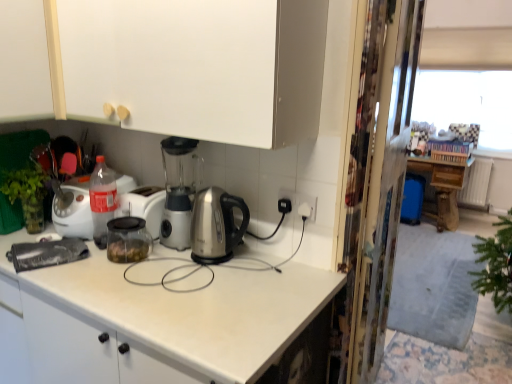
Question: Is wooden table at right further to camera compared to white matte cabinet at upper center, arranged as the first cabinetry when viewed from the right?

Choices:
 (A) yes
 (B) no

Answer: (A)

Question: Could you tell me if wooden table at right is turned towards white matte cabinet at upper center, arranged as the first cabinetry when viewed from the right?

Choices:
 (A) yes
 (B) no

Answer: (A)

Question: Is white matte cabinet at upper center, arranged as the first cabinetry when viewed from the right, a part of wooden table at right?

Choices:
 (A) yes
 (B) no

Answer: (B)

Question: Can you confirm if wooden table at right is shorter than white matte cabinet at upper center, arranged as the first cabinetry when viewed from the right?

Choices:
 (A) no
 (B) yes

Answer: (A)

Question: From the image's perspective, is wooden table at right over white matte cabinet at upper center, acting as the second cabinetry starting from the left?

Choices:
 (A) no
 (B) yes

Answer: (A)

Question: Is wooden table at right smaller than white matte cabinet at upper center, acting as the second cabinetry starting from the left?

Choices:
 (A) yes
 (B) no

Answer: (A)

Question: Considering the relative sizes of clear glass jar at center and white matte cabinet at upper center, acting as the second cabinetry starting from the left, in the image provided, is clear glass jar at center wider than white matte cabinet at upper center, acting as the second cabinetry starting from the left,?

Choices:
 (A) yes
 (B) no

Answer: (B)

Question: Does clear glass jar at center have a larger size compared to white matte cabinet at upper center, arranged as the first cabinetry when viewed from the right?

Choices:
 (A) yes
 (B) no

Answer: (B)

Question: Does clear glass jar at center have a lesser height compared to white matte cabinet at upper center, acting as the second cabinetry starting from the left?

Choices:
 (A) yes
 (B) no

Answer: (A)

Question: Is clear glass jar at center placed right next to white matte cabinet at upper center, arranged as the first cabinetry when viewed from the right?

Choices:
 (A) no
 (B) yes

Answer: (A)

Question: Is the position of clear glass jar at center more distant than that of white matte cabinet at upper center, acting as the second cabinetry starting from the left?

Choices:
 (A) no
 (B) yes

Answer: (B)

Question: From a real-world perspective, is clear glass jar at center beneath white matte cabinet at upper center, acting as the second cabinetry starting from the left?

Choices:
 (A) no
 (B) yes

Answer: (B)

Question: Considering the relative positions of transparent plastic screen door at right and white matte cabinet at upper left, arranged as the first cabinetry when viewed from the left, in the image provided, is transparent plastic screen door at right behind white matte cabinet at upper left, arranged as the first cabinetry when viewed from the left,?

Choices:
 (A) no
 (B) yes

Answer: (B)